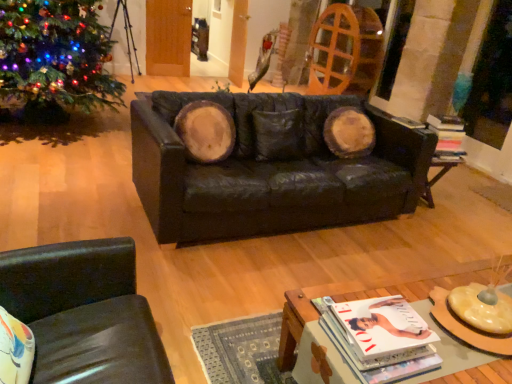
This screenshot has height=384, width=512. What are the coordinates of `vacant area located to the right-hand side of matte white magazine at lower center, placed as the 1th magazine when sorted from left to right` in the screenshot? It's located at (458, 352).